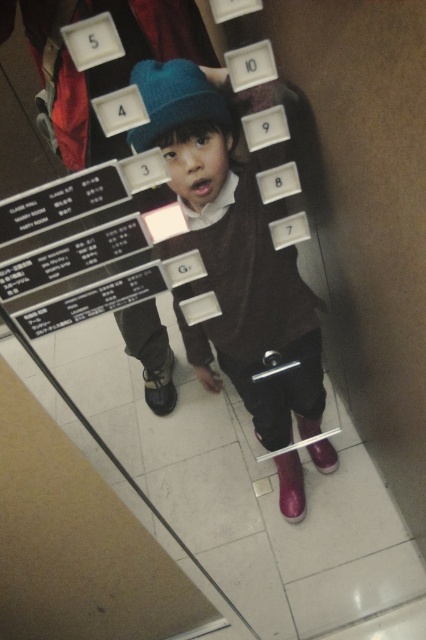
You are a fashion designer examining the image of a child wearing two different boots. The shiny purple boot at lower center and the leather boot at lower center. Which boot has a greater width?

The shiny purple boot at lower center has a greater width than the leather boot at lower center as stated in the description.